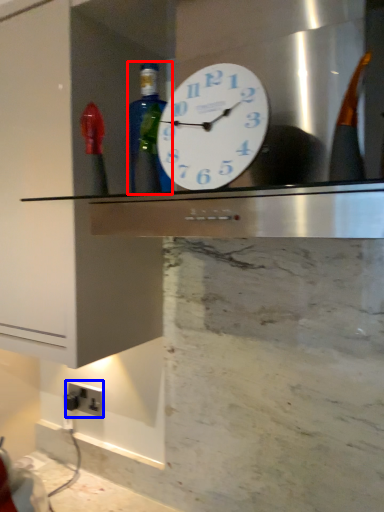
Question: Which point is further to the camera, bottle (highlighted by a red box) or electric outlet (highlighted by a blue box)?

Choices:
 (A) bottle
 (B) electric outlet

Answer: (B)